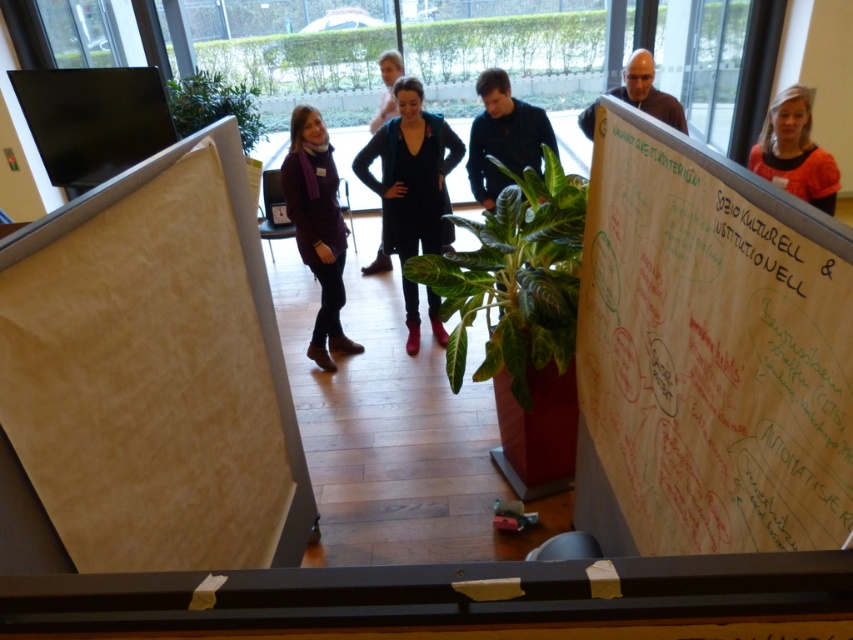
You are standing in the meeting room looking at the flip charts. There are two points marked on the right flip chart with notes. The first point is at coordinate (825,173) and the second at (637,138). Which point is closer to you?

Point (637,138) is closer to you because it is less further away than point (825,173).

You are an interior designer observing the meeting room. You see the orange matte shirt at upper right and the white paperboard at upper center. Which object takes up more visual space in the scene?

The orange matte shirt at upper right is bigger than the white paperboard at upper center, so it takes up more visual space in the scene.

You are standing at the entrance of the meeting room and want to locate the person wearing the orange matte shirt at upper right. Based on the coordinates provided, can you determine if this shirt is positioned to the left or right side of the room?

The orange matte shirt at upper right is located at point 0.237 on the x and 0.932 on the y. Since the x coordinate is less than 0.5, it is positioned to the left side of the room.